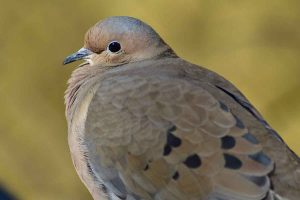
This screenshot has height=200, width=300. I want to click on the chest, so click(x=71, y=141).